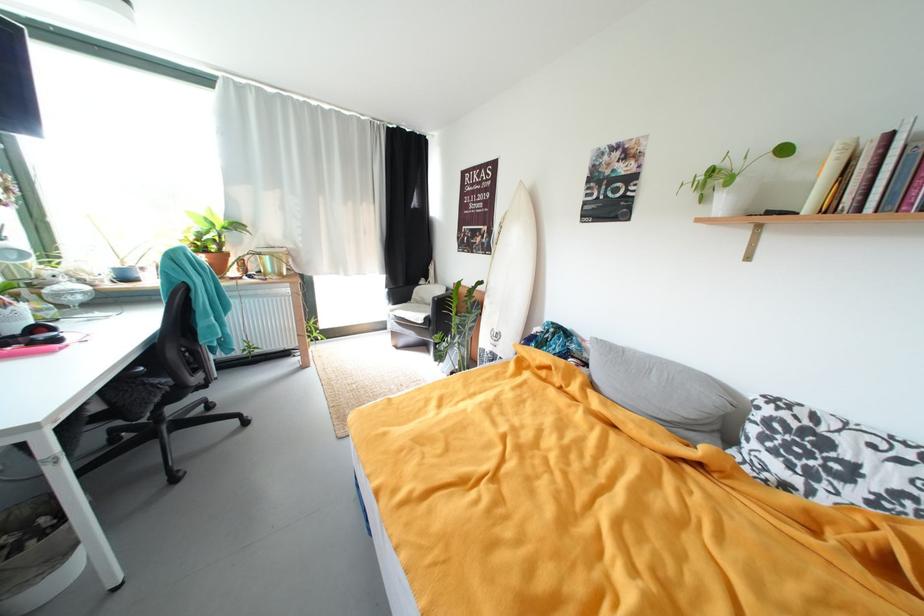
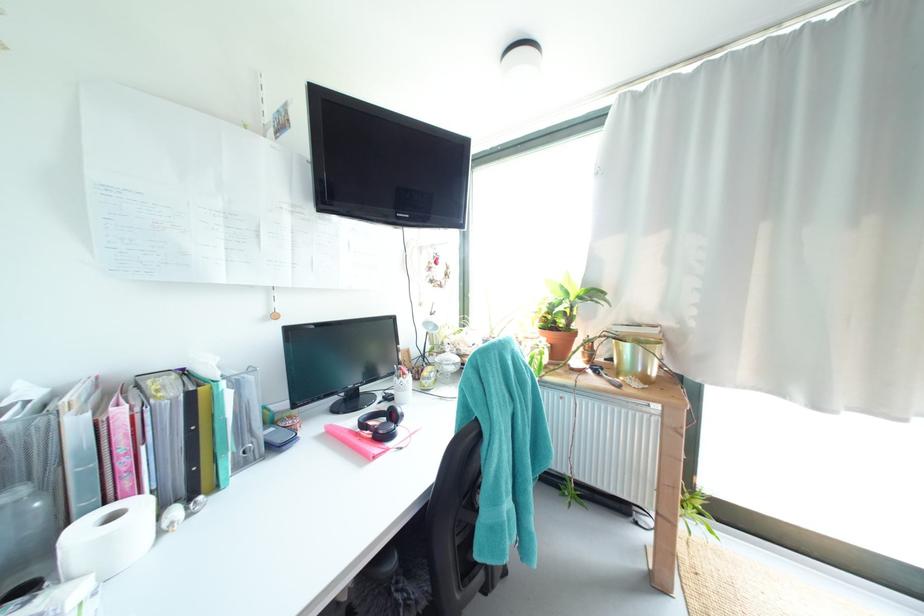
Find the pixel in the second image that matches point 259,278 in the first image.

(603, 373)